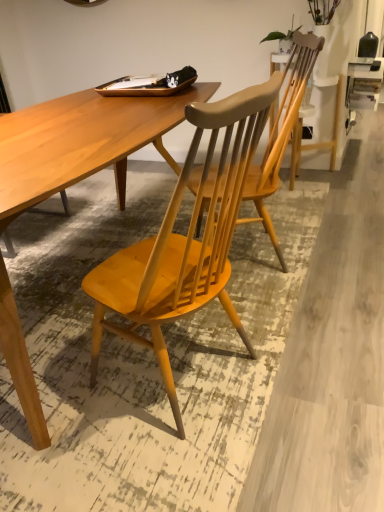
Question: Based on their positions, is matte wood chair at center located to the left or right of light brown wood desk at center?

Choices:
 (A) right
 (B) left

Answer: (A)

Question: Relative to light brown wood desk at center, is matte wood chair at center in front or behind?

Choices:
 (A) behind
 (B) front

Answer: (A)

Question: From the image's perspective, is matte wood chair at center above or below light brown wood desk at center?

Choices:
 (A) below
 (B) above

Answer: (B)

Question: Is light brown wood desk at center taller or shorter than matte wood chair at center?

Choices:
 (A) tall
 (B) short

Answer: (B)

Question: Considering the relative positions of light brown wood desk at center and matte wood chair at center in the image provided, is light brown wood desk at center to the left or to the right of matte wood chair at center?

Choices:
 (A) left
 (B) right

Answer: (A)

Question: Is light brown wood desk at center bigger or smaller than matte wood chair at center?

Choices:
 (A) big
 (B) small

Answer: (A)

Question: Is light brown wood desk at center spatially inside matte wood chair at center, or outside of it?

Choices:
 (A) outside
 (B) inside

Answer: (A)